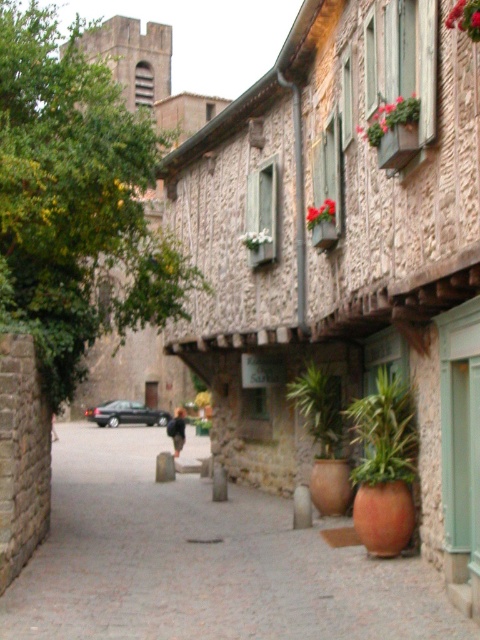
Question: Which point is closer to the camera?

Choices:
 (A) (312, 221)
 (B) (268, 236)
 (C) (395, 433)
 (D) (291, 380)

Answer: (C)

Question: Does paved stone walkway at center come behind green leafy plant at center-right?

Choices:
 (A) yes
 (B) no

Answer: (B)

Question: Considering the relative positions of green leafy plant at center-right and green leafy plant at lower center in the image provided, where is green leafy plant at center-right located with respect to green leafy plant at lower center?

Choices:
 (A) left
 (B) right

Answer: (B)

Question: Where is paved stone walkway at center located in relation to green leafy plant at center-right in the image?

Choices:
 (A) right
 (B) left

Answer: (B)

Question: Which point is farther to the camera?

Choices:
 (A) (x=327, y=385)
 (B) (x=396, y=465)

Answer: (A)

Question: Which of the following is the closest to the observer?

Choices:
 (A) (377, 141)
 (B) (129, 536)
 (C) (316, 412)

Answer: (A)